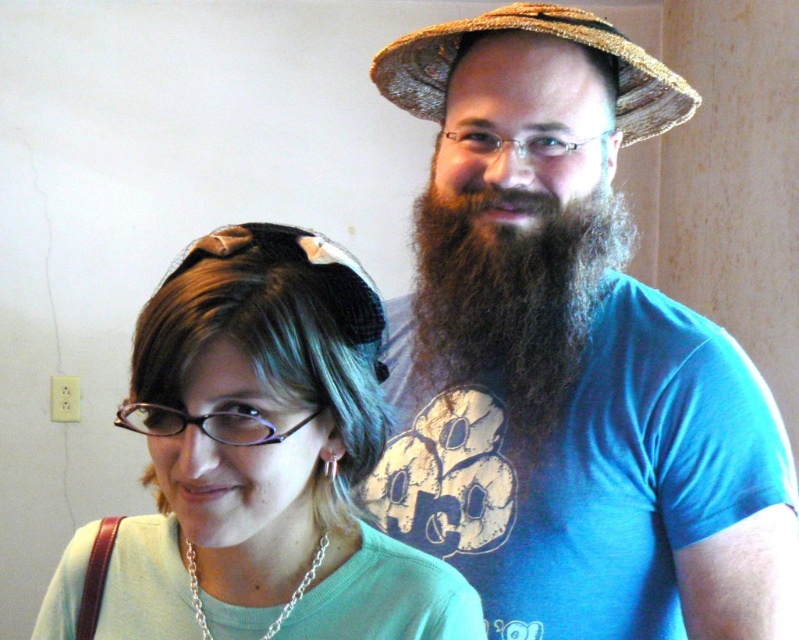
Question: Which object is closer to the camera taking this photo?

Choices:
 (A) blue cotton t-shirt at center
 (B) multicolored fabric hairband at upper left
 (C) woven straw hat at upper center
 (D) green matte shirt at lower left

Answer: (D)

Question: Is the position of blue cotton t-shirt at center more distant than that of woven straw hat at upper center?

Choices:
 (A) no
 (B) yes

Answer: (A)

Question: Is green matte shirt at lower left closer to the viewer compared to multicolored fabric hairband at upper left?

Choices:
 (A) yes
 (B) no

Answer: (A)

Question: Considering the real-world distances, which object is farthest from the multicolored fabric hairband at upper left?

Choices:
 (A) woven straw hat at upper center
 (B) green matte shirt at lower left
 (C) brown fuzzy beard at right
 (D) blue cotton t-shirt at center

Answer: (A)

Question: Where is blue cotton t-shirt at center located in relation to green matte shirt at lower left in the image?

Choices:
 (A) right
 (B) left

Answer: (A)

Question: Which point is closer to the camera taking this photo?

Choices:
 (A) (427, 84)
 (B) (509, 404)

Answer: (B)